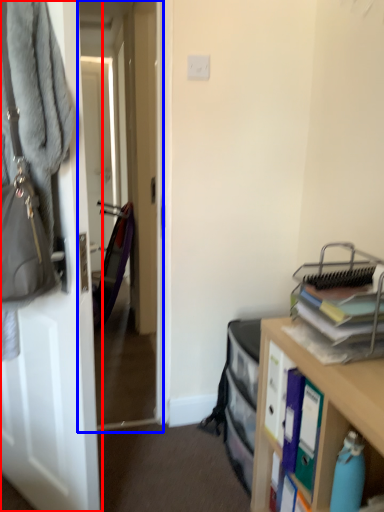
Question: Which object appears closest to the camera in this image, door (highlighted by a red box) or passage (highlighted by a blue box)?

Choices:
 (A) door
 (B) passage

Answer: (A)